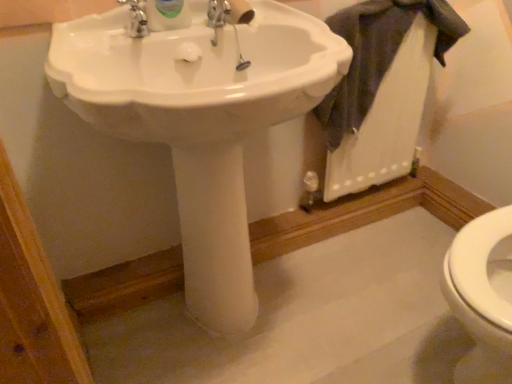
The height and width of the screenshot is (384, 512). What do you see at coordinates (378, 55) in the screenshot?
I see `dark gray fabric at upper right` at bounding box center [378, 55].

The width and height of the screenshot is (512, 384). In order to click on dark gray fabric at upper right in this screenshot , I will do `click(378, 55)`.

In order to face white glossy sink at center, should I rotate leftwards or rightwards?

To align with it, rotate left about 5.183°.

Measure the distance between white glossy sink at center and camera.

white glossy sink at center and camera are 24.25 inches apart from each other.

Locate an element on the screen. Image resolution: width=512 pixels, height=384 pixels. white glossy sink at center is located at coordinates (201, 120).

This screenshot has width=512, height=384. What do you see at coordinates (201, 120) in the screenshot?
I see `white glossy sink at center` at bounding box center [201, 120].

Where is `dark gray fabric at upper right`? Image resolution: width=512 pixels, height=384 pixels. dark gray fabric at upper right is located at coordinates (378, 55).

Considering the positions of objects white glossy sink at center and dark gray fabric at upper right in the image provided, who is more to the right, white glossy sink at center or dark gray fabric at upper right?

Positioned to the right is dark gray fabric at upper right.

Between white glossy sink at center and dark gray fabric at upper right, which one is positioned behind?

dark gray fabric at upper right is behind.

Does point (175, 102) appear closer or farther from the camera than point (341, 101)?

Clearly, point (175, 102) is closer to the camera than point (341, 101).

From the image's perspective, which is above, white glossy sink at center or dark gray fabric at upper right?

dark gray fabric at upper right appears higher in the image.

From a real-world perspective, who is located higher, white glossy sink at center or dark gray fabric at upper right?

From a 3D spatial view, dark gray fabric at upper right is above.

Considering the sizes of white glossy sink at center and dark gray fabric at upper right in the image, is white glossy sink at center wider or thinner than dark gray fabric at upper right?

Clearly, white glossy sink at center has more width compared to dark gray fabric at upper right.

In terms of height, does white glossy sink at center look taller or shorter compared to dark gray fabric at upper right?

Considering their sizes, white glossy sink at center has more height than dark gray fabric at upper right.

Based on their sizes in the image, would you say white glossy sink at center is bigger or smaller than dark gray fabric at upper right?

Considering their sizes, white glossy sink at center takes up more space than dark gray fabric at upper right.

Could dark gray fabric at upper right be considered to be inside white glossy sink at center?

No, white glossy sink at center does not contain dark gray fabric at upper right.

Is white glossy sink at center in contact with dark gray fabric at upper right?

No, white glossy sink at center is not beside dark gray fabric at upper right.

Is white glossy sink at center oriented away from dark gray fabric at upper right?

No, white glossy sink at center's orientation is not away from dark gray fabric at upper right.

How different are the orientations of white glossy sink at center and dark gray fabric at upper right in degrees?

The facing directions of white glossy sink at center and dark gray fabric at upper right are 0.00271 degrees apart.

Find the location of `bath towel above the white glossy sink at center (from a real-world perspective)`. bath towel above the white glossy sink at center (from a real-world perspective) is located at coordinates (378, 55).

Between dark gray fabric at upper right and white glossy sink at center, which one appears on the left side from the viewer's perspective?

white glossy sink at center.

Which is behind, dark gray fabric at upper right or white glossy sink at center?

dark gray fabric at upper right.

Is point (351, 38) positioned behind point (325, 66)?

Yes, it is.

From the image's perspective, is dark gray fabric at upper right located above white glossy sink at center?

Correct, dark gray fabric at upper right appears higher than white glossy sink at center in the image.

From a real-world perspective, who is located lower, dark gray fabric at upper right or white glossy sink at center?

white glossy sink at center is physically lower.

Is dark gray fabric at upper right wider or thinner than white glossy sink at center?

In the image, dark gray fabric at upper right appears to be more narrow than white glossy sink at center.

Based on the photo, considering the relative sizes of dark gray fabric at upper right and white glossy sink at center in the image provided, is dark gray fabric at upper right taller than white glossy sink at center?

No.

Considering the sizes of objects dark gray fabric at upper right and white glossy sink at center in the image provided, who is smaller, dark gray fabric at upper right or white glossy sink at center?

Smaller between the two is dark gray fabric at upper right.

Is white glossy sink at center located within dark gray fabric at upper right?

No, white glossy sink at center is not inside dark gray fabric at upper right.

Would you say dark gray fabric at upper right is a long distance from white glossy sink at center?

No, dark gray fabric at upper right is in close proximity to white glossy sink at center.

Is dark gray fabric at upper right positioned with its back to white glossy sink at center?

No, white glossy sink at center is not at the back of dark gray fabric at upper right.

How many degrees apart are the facing directions of dark gray fabric at upper right and white glossy sink at center?

The facing directions of dark gray fabric at upper right and white glossy sink at center are 0.00271 degrees apart.

How far apart are dark gray fabric at upper right and white glossy sink at center?

A distance of 43.97 centimeters exists between dark gray fabric at upper right and white glossy sink at center.

The image size is (512, 384). I want to click on bath towel that appears on the right of white glossy sink at center, so click(378, 55).

Where is `sink in front of the dark gray fabric at upper right`? This screenshot has width=512, height=384. sink in front of the dark gray fabric at upper right is located at coordinates (201, 120).

Where is `bath towel above the white glossy sink at center (from a real-world perspective)`? The image size is (512, 384). bath towel above the white glossy sink at center (from a real-world perspective) is located at coordinates (378, 55).